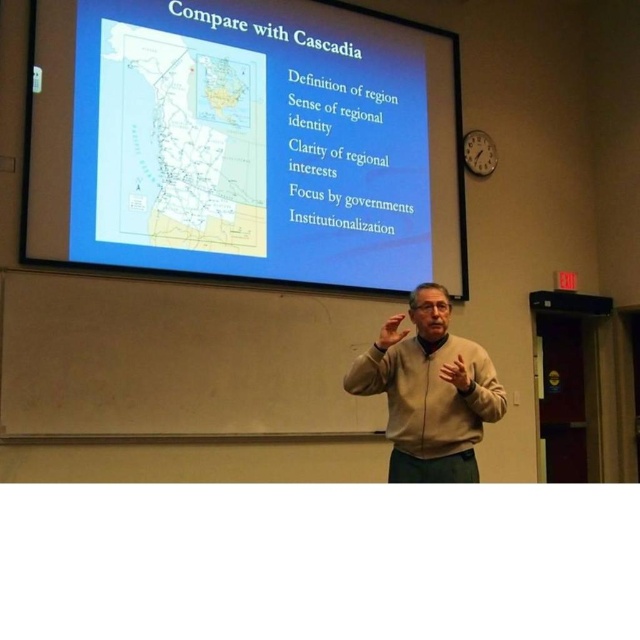
From the picture: Is white matte projection screen at upper center wider than beige sweater at center?

Yes.

Who is positioned more to the left, white matte projection screen at upper center or beige sweater at center?

From the viewer's perspective, white matte projection screen at upper center appears more on the left side.

Where is `white matte projection screen at upper center`? The image size is (640, 640). white matte projection screen at upper center is located at coordinates [244, 141].